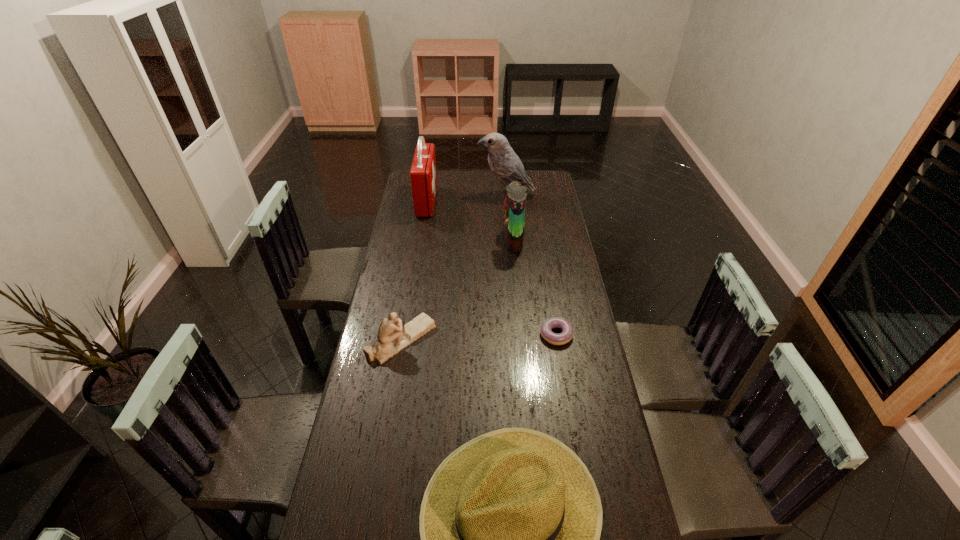
Where is `doughnut that is at the right edge`? The image size is (960, 540). doughnut that is at the right edge is located at coordinates (546, 328).

Where is `object at the far left corner`? object at the far left corner is located at coordinates (423, 176).

The image size is (960, 540). I want to click on object located at the far right corner, so click(x=505, y=164).

Identify the location of free space at the far edge of the desktop. The image size is (960, 540). (477, 180).

In the image, there is a desktop. At what (x,y) coordinates should I click in order to perform the action: click on vacant space at the left edge. Please return your answer as a coordinate pair (x, y). Looking at the image, I should click on (385, 525).

Locate an element on the screen. Image resolution: width=960 pixels, height=540 pixels. vacant area at the right edge is located at coordinates tap(594, 383).

Find the location of a particular element. vacant space at the far right corner of the desktop is located at coordinates (545, 191).

This screenshot has height=540, width=960. Identify the location of free point between the first-aid kit and the farther parrot. (467, 199).

Find the location of `free spot between the figurine and the first-aid kit`. free spot between the figurine and the first-aid kit is located at coordinates (414, 271).

Locate an element on the screen. This screenshot has height=540, width=960. free space between the shortest object and the figurine is located at coordinates (479, 337).